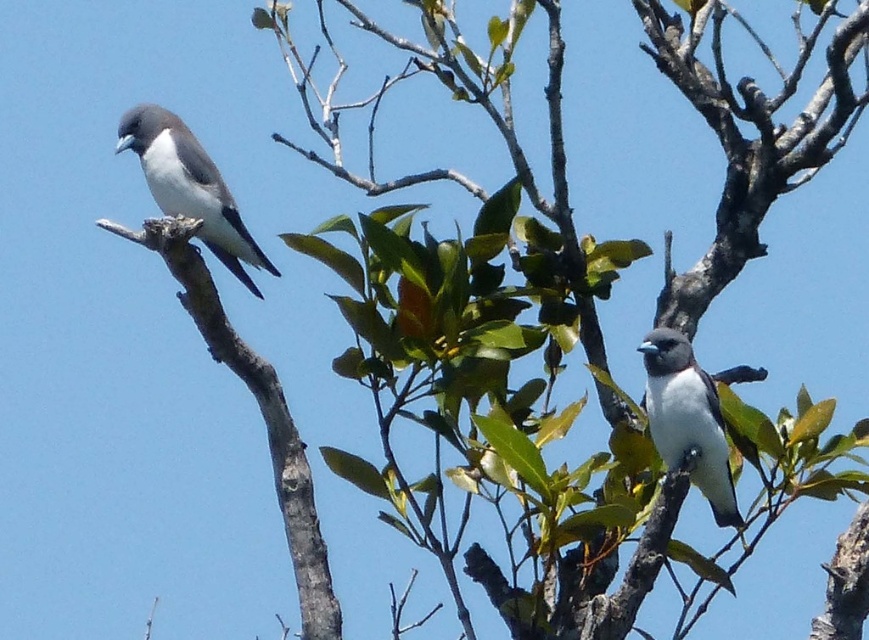
Question: Is white glossy bird at upper left positioned at the back of white matte bird at center?

Choices:
 (A) yes
 (B) no

Answer: (B)

Question: Among these objects, which one is farthest from the camera?

Choices:
 (A) white matte bird at center
 (B) white glossy bird at upper left

Answer: (A)

Question: Does white glossy bird at upper left have a smaller size compared to white matte bird at center?

Choices:
 (A) yes
 (B) no

Answer: (B)

Question: Does white glossy bird at upper left have a greater width compared to white matte bird at center?

Choices:
 (A) no
 (B) yes

Answer: (B)